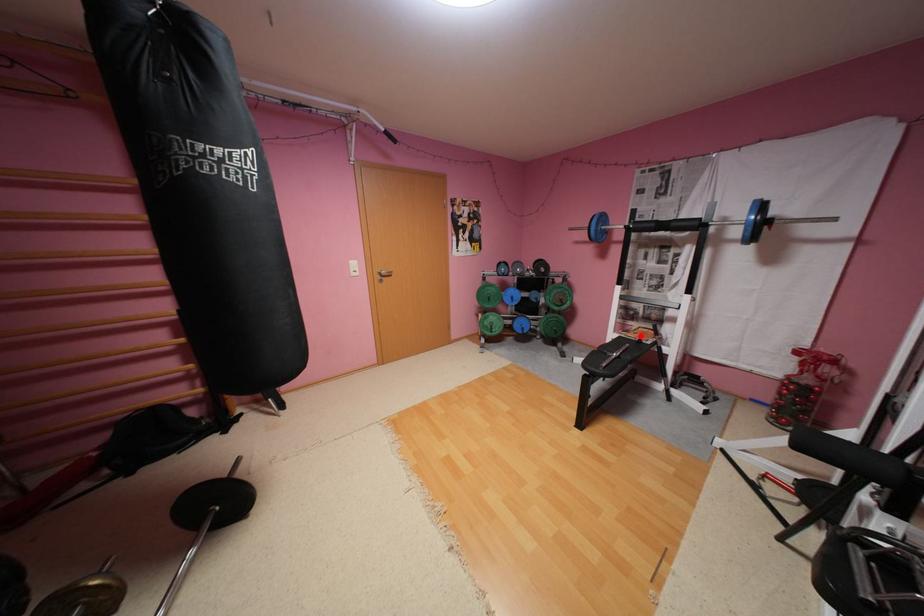
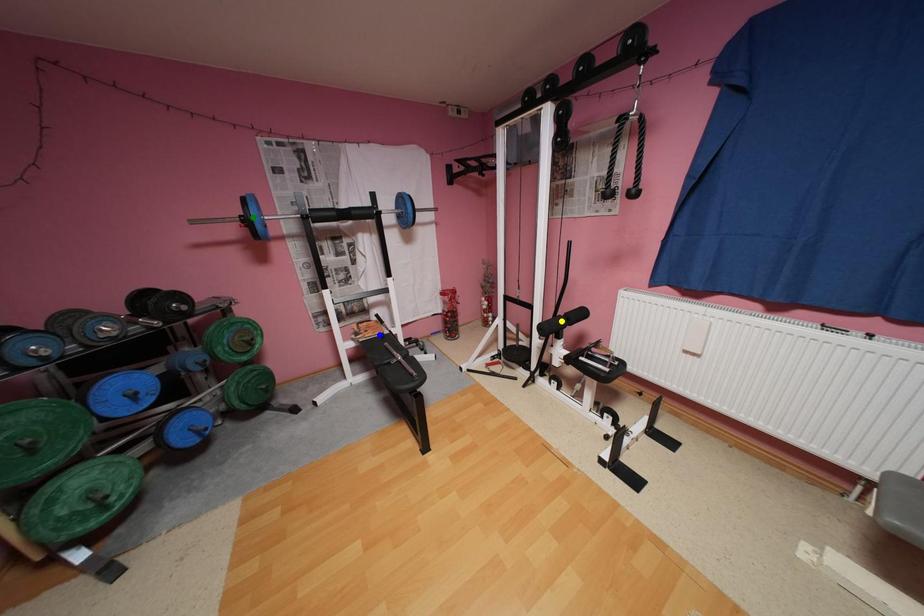
Question: I am providing you with two images of the same scene from different viewpoints. A red point is marked on the first image. You are given multiple points on the second image. Which spot in image 2 lines up with the point in image 1?

Choices:
 (A) yellow point
 (B) green point
 (C) blue point

Answer: (C)